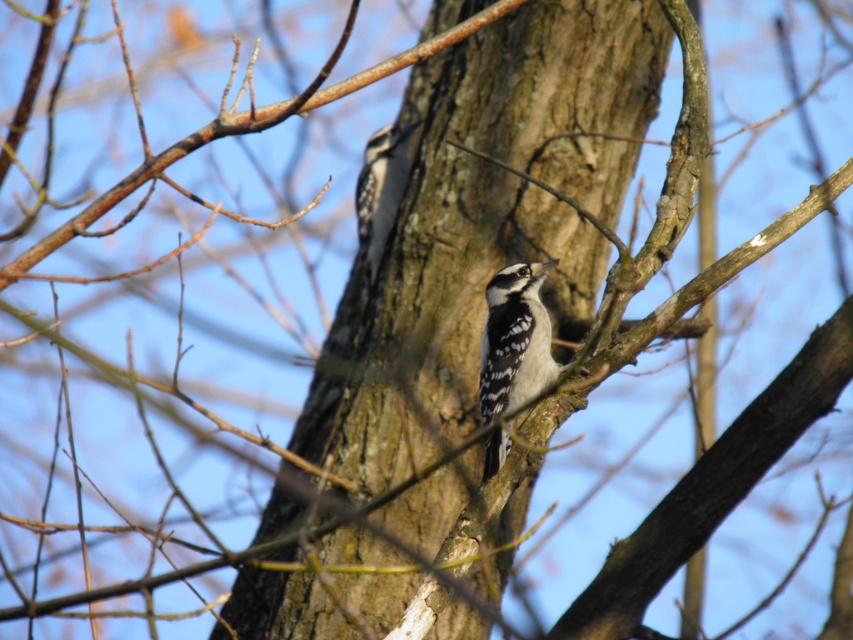
Question: Which point appears closest to the camera in this image?

Choices:
 (A) (379, 211)
 (B) (492, 282)
 (C) (442, 36)

Answer: (C)

Question: In this image, where is brown rough bark at center located relative to white speckled woodpecker at center?

Choices:
 (A) above
 (B) below

Answer: (A)

Question: Where is brown rough bark at center located in relation to white speckled woodpecker at center in the image?

Choices:
 (A) below
 (B) above

Answer: (B)

Question: Which of the following is the farthest from the observer?

Choices:
 (A) (489, 387)
 (B) (297, 109)
 (C) (389, 211)

Answer: (C)

Question: Considering the relative positions of white speckled woodpecker at center and speckled brown woodpecker at center in the image provided, where is white speckled woodpecker at center located with respect to speckled brown woodpecker at center?

Choices:
 (A) right
 (B) left

Answer: (A)

Question: Which object appears closest to the camera in this image?

Choices:
 (A) white speckled woodpecker at center
 (B) brown rough bark at center
 (C) speckled brown woodpecker at center

Answer: (B)